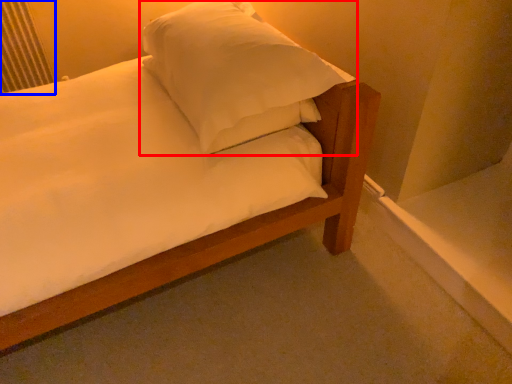
Question: Which of the following is the farthest to the observer, pillow (highlighted by a red box) or radiator (highlighted by a blue box)?

Choices:
 (A) pillow
 (B) radiator

Answer: (B)